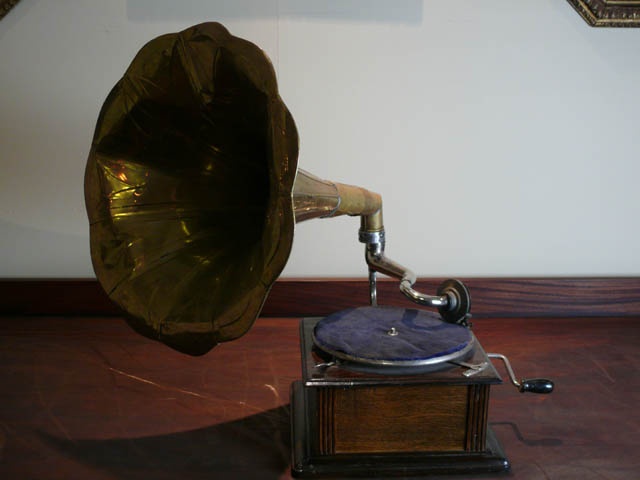
Where is `small edge of frame for photo or mirror`? This screenshot has width=640, height=480. small edge of frame for photo or mirror is located at coordinates (600, 8), (621, 15).